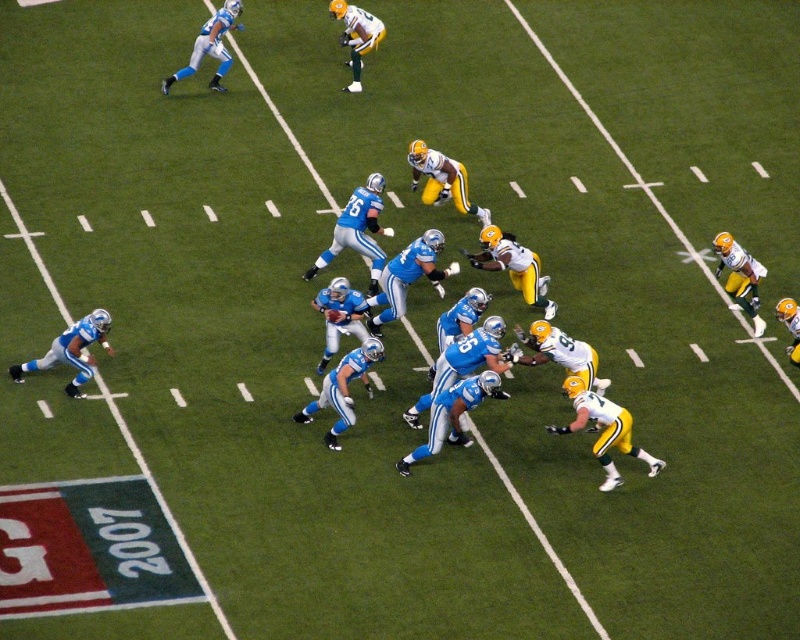
Question: Can you confirm if matte blue uniform at lower left is positioned to the left of yellow-green uniform at center?

Choices:
 (A) yes
 (B) no

Answer: (A)

Question: Which point is farther from the camera taking this photo?

Choices:
 (A) (582, 388)
 (B) (222, 60)
 (C) (416, 150)

Answer: (B)

Question: Is matte blue uniform at lower left positioned before light blue jersey at upper left?

Choices:
 (A) no
 (B) yes

Answer: (B)

Question: Which point is closer to the camera?

Choices:
 (A) green matte jersey at right
 (B) blue matte jersey at center
 (C) light blue jersey at upper left
 (D) matte blue uniform at lower left

Answer: (B)

Question: Is yellow-green uniform at center wider than light blue jersey at upper left?

Choices:
 (A) no
 (B) yes

Answer: (A)

Question: Considering the real-world distances, which object is farthest from the yellow-green uniform at center?

Choices:
 (A) matte blue uniform at lower left
 (B) blue matte jersey at center
 (C) light blue jersey at upper left

Answer: (A)